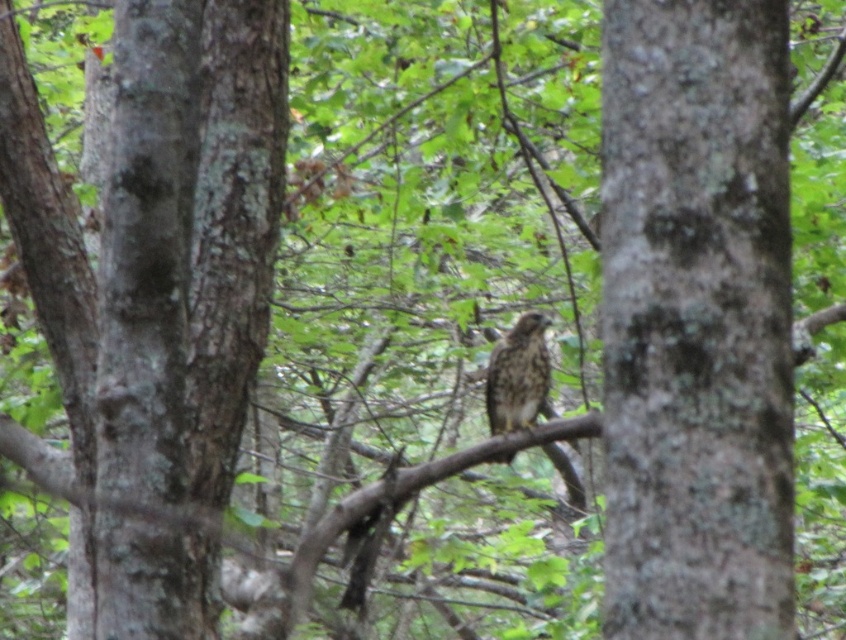
Does rough bark tree at center appear on the right side of brown speckled feathers at center?

Yes, rough bark tree at center is to the right of brown speckled feathers at center.

Is rough bark tree at center above brown speckled feathers at center?

Yes, rough bark tree at center is above brown speckled feathers at center.

Describe the element at coordinates (696, 321) in the screenshot. I see `rough bark tree at center` at that location.

Where is `rough bark tree at center`? rough bark tree at center is located at coordinates (x=696, y=321).